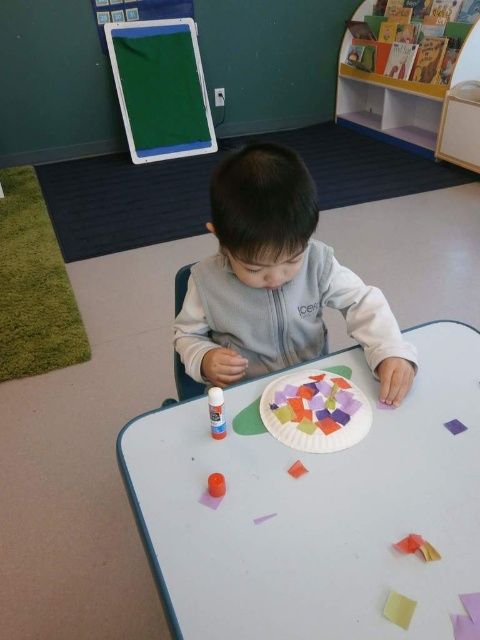
Question: Is white paper plate at center to the left of orange matte paper at center from the viewer's perspective?

Choices:
 (A) yes
 (B) no

Answer: (B)

Question: Which object is the closest to the gold metallic toy at lower right?

Choices:
 (A) white paper plate at center
 (B) yellow matte paper at lower right
 (C) multicolored paper at center
 (D) orange matte paper triangle at center

Answer: (B)

Question: Based on their relative distances, which object is farther from the white paper plate at center?

Choices:
 (A) gold metallic toy at lower right
 (B) orange matte paper at center
 (C) matte glue stick at center
 (D) gray fleece toddler at center

Answer: (C)

Question: Among these objects, which one is farthest from the camera?

Choices:
 (A) orange matte paper triangle at center
 (B) white paper plate at center

Answer: (A)

Question: Does white paper plate at center have a greater width compared to multicolored paper at center?

Choices:
 (A) no
 (B) yes

Answer: (B)

Question: Can you confirm if yellow matte paper at lower right is smaller than gold metallic toy at lower right?

Choices:
 (A) no
 (B) yes

Answer: (B)